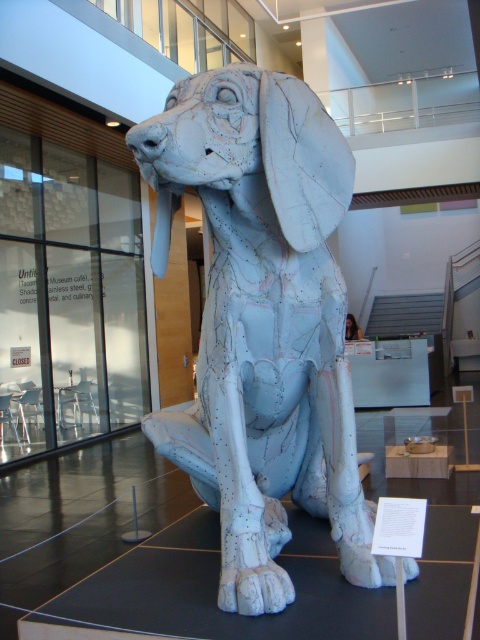
Which of these two, white matte sculpture at center or white matte tusk at center, stands shorter?

With less height is white matte tusk at center.

Consider the image. Who is positioned more to the right, white matte sculpture at center or white matte tusk at center?

white matte sculpture at center is more to the right.

Does point (301, 301) lie in front of point (167, 205)?

That is True.

Image resolution: width=480 pixels, height=640 pixels. I want to click on white matte sculpture at center, so click(264, 324).